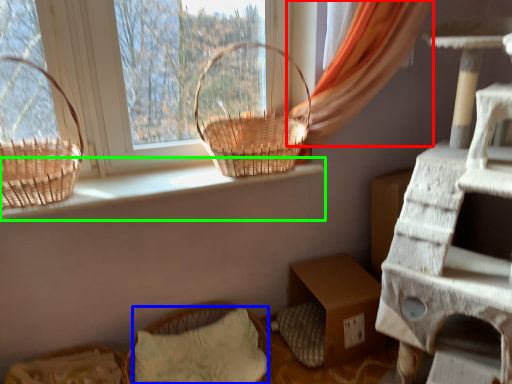
Question: Estimate the real-world distances between objects in this image. Which object is farther from curtain (highlighted by a red box), pillow (highlighted by a blue box) or window sill (highlighted by a green box)?

Choices:
 (A) pillow
 (B) window sill

Answer: (A)